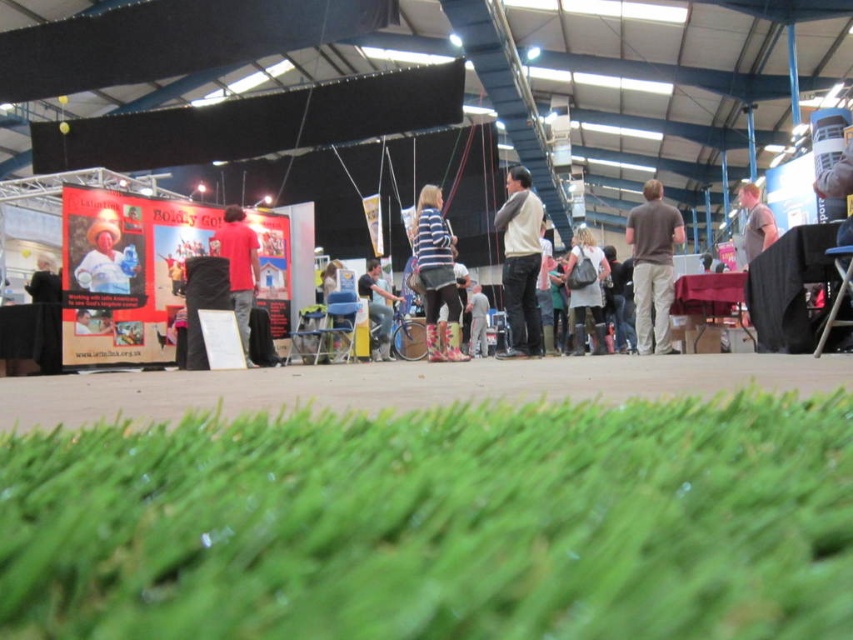
Does red cotton shirt at center have a lesser width compared to light gray fabric pants at center?

No, red cotton shirt at center is not thinner than light gray fabric pants at center.

Between point (241, 264) and point (474, 288), which one is positioned behind?

The point (474, 288) is more distant.

Image resolution: width=853 pixels, height=640 pixels. I want to click on red cotton shirt at center, so click(239, 268).

Is brown cotton shirt at center below red cotton shirt at center?

Actually, brown cotton shirt at center is above red cotton shirt at center.

Is point (647, 195) farther from viewer compared to point (216, 244)?

No, it is not.

Between point (654, 180) and point (245, 259), which one is positioned in front?

Point (654, 180) is in front.

The width and height of the screenshot is (853, 640). In order to click on brown cotton shirt at center in this screenshot , I will do `click(653, 266)`.

Is brown cotton shirt at center to the left of striped fabric shirt at center from the viewer's perspective?

No, brown cotton shirt at center is not to the left of striped fabric shirt at center.

Which is in front, point (660, 211) or point (416, 275)?

Positioned in front is point (416, 275).

Does point (633, 228) come in front of point (459, 307)?

No.

At what (x,y) coordinates should I click in order to perform the action: click on brown cotton shirt at center. Please return your answer as a coordinate pair (x, y). Looking at the image, I should click on (653, 266).